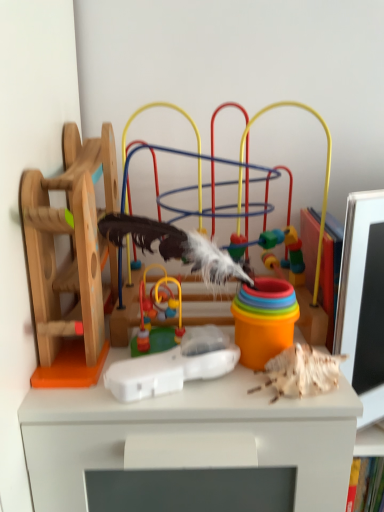
Question: From the image's perspective, is multicolored plastic toy at center, the 1th toy positioned from the right, above white plastic remote at center, arranged as the second toy when viewed from the right?

Choices:
 (A) yes
 (B) no

Answer: (A)

Question: Does multicolored plastic toy at center, the 1th toy positioned from the right, have a greater height compared to white plastic remote at center, the 3th toy viewed from the left?

Choices:
 (A) no
 (B) yes

Answer: (B)

Question: Considering the relative sizes of multicolored plastic toy at center, which appears as the fourth toy when viewed from the left, and white plastic remote at center, arranged as the second toy when viewed from the right, in the image provided, is multicolored plastic toy at center, which appears as the fourth toy when viewed from the left, bigger than white plastic remote at center, arranged as the second toy when viewed from the right,?

Choices:
 (A) no
 (B) yes

Answer: (B)

Question: From the image's perspective, is multicolored plastic toy at center, which appears as the fourth toy when viewed from the left, beneath white plastic remote at center, the 3th toy viewed from the left?

Choices:
 (A) no
 (B) yes

Answer: (A)

Question: Is multicolored plastic toy at center, the 1th toy positioned from the right, oriented towards white plastic remote at center, arranged as the second toy when viewed from the right?

Choices:
 (A) yes
 (B) no

Answer: (A)

Question: From a real-world perspective, is wooden toy at left, acting as the 4th toy starting from the right, above or below multicolored plastic toy at center, which appears as the fourth toy when viewed from the left?

Choices:
 (A) below
 (B) above

Answer: (A)

Question: In the image, is wooden toy at left, acting as the 4th toy starting from the right, on the left side or the right side of multicolored plastic toy at center, the 1th toy positioned from the right?

Choices:
 (A) left
 (B) right

Answer: (A)

Question: From their relative heights in the image, would you say wooden toy at left, acting as the 4th toy starting from the right, is taller or shorter than multicolored plastic toy at center, which appears as the fourth toy when viewed from the left?

Choices:
 (A) tall
 (B) short

Answer: (B)

Question: Does point (81, 190) appear closer or farther from the camera than point (87, 336)?

Choices:
 (A) farther
 (B) closer

Answer: (B)

Question: In terms of width, does multicolored plastic toy at center, which appears as the fourth toy when viewed from the left, look wider or thinner when compared to white plastic remote at center, the 3th toy viewed from the left?

Choices:
 (A) thin
 (B) wide

Answer: (B)

Question: Does point (29, 205) appear closer or farther from the camera than point (218, 352)?

Choices:
 (A) closer
 (B) farther

Answer: (A)

Question: Is multicolored plastic toy at center, the 1th toy positioned from the right, taller or shorter than white plastic remote at center, the 3th toy viewed from the left?

Choices:
 (A) tall
 (B) short

Answer: (A)

Question: From the image's perspective, is multicolored plastic toy at center, the 1th toy positioned from the right, above or below white plastic remote at center, arranged as the second toy when viewed from the right?

Choices:
 (A) above
 (B) below

Answer: (A)

Question: Is multicolored plastic toy at center, which appears as the fourth toy when viewed from the left, bigger or smaller than smooth plastic toy at center, placed as the second toy when sorted from left to right?

Choices:
 (A) small
 (B) big

Answer: (B)

Question: Considering the positions of multicolored plastic toy at center, the 1th toy positioned from the right, and smooth plastic toy at center, placed as the second toy when sorted from left to right, in the image, is multicolored plastic toy at center, the 1th toy positioned from the right, wider or thinner than smooth plastic toy at center, placed as the second toy when sorted from left to right,?

Choices:
 (A) wide
 (B) thin

Answer: (A)